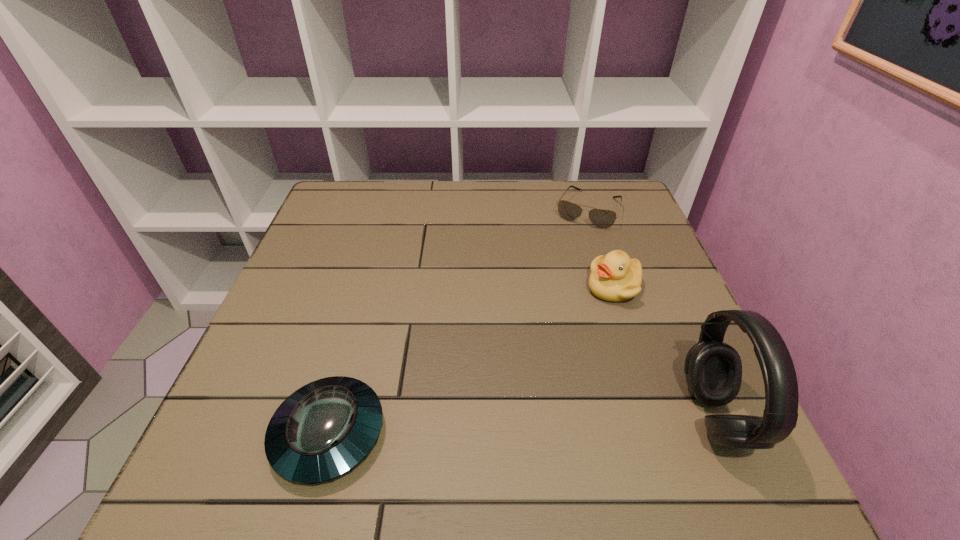
Where is `vacant space that satisfies the following two spatial constraints: 1. on the front side of the farthest object; 2. on the earcups of the tallest object`? vacant space that satisfies the following two spatial constraints: 1. on the front side of the farthest object; 2. on the earcups of the tallest object is located at coordinates (654, 416).

In order to click on free spot that satisfies the following two spatial constraints: 1. on the front side of the headset; 2. on the earcups of the third nearest object in this screenshot , I will do [656, 416].

This screenshot has width=960, height=540. What are the coordinates of `free space that satisfies the following two spatial constraints: 1. on the back side of the second farthest object; 2. on the left side of the saucer` in the screenshot? It's located at (369, 288).

At what (x,y) coordinates should I click in order to perform the action: click on free space that satisfies the following two spatial constraints: 1. on the back side of the tallest object; 2. on the earcups of the leftmost object. Please return your answer as a coordinate pair (x, y). This screenshot has height=540, width=960. Looking at the image, I should click on (334, 416).